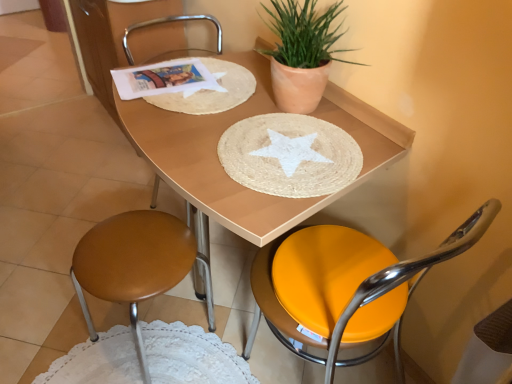
The height and width of the screenshot is (384, 512). What are the coordinates of `vacant space underneath terracotta clay pot at upper right (from a real-world perspective)` in the screenshot? It's located at (292, 110).